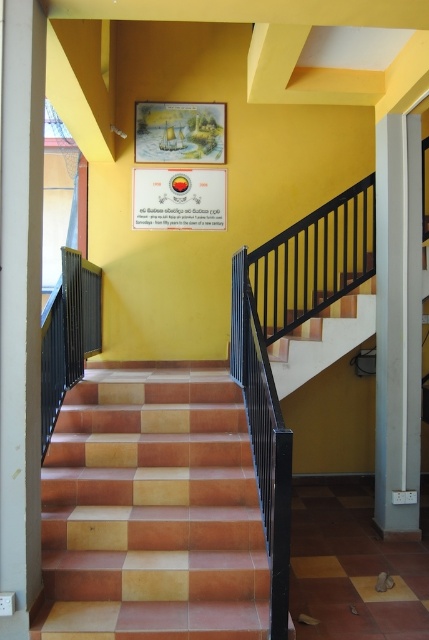
Question: Does white smooth pillar at left appear on the right side of matte paper sign at upper center?

Choices:
 (A) no
 (B) yes

Answer: (A)

Question: Which object is positioned closest to the white smooth pillar at left?

Choices:
 (A) white smooth pillar at right
 (B) terracotta tile stairs at center

Answer: (B)

Question: Which object is positioned farthest from the white smooth pillar at left?

Choices:
 (A) white smooth pillar at right
 (B) terracotta tile stairs at center
 (C) matte paper sign at upper center

Answer: (C)

Question: Does terracotta tile stairs at center come in front of matte paper sign at upper center?

Choices:
 (A) no
 (B) yes

Answer: (B)

Question: Among these objects, which one is farthest from the camera?

Choices:
 (A) matte paper sign at upper center
 (B) white smooth pillar at left
 (C) terracotta tile stairs at center
 (D) white smooth pillar at right

Answer: (A)

Question: Can you confirm if terracotta tile stairs at center is smaller than matte paper sign at upper center?

Choices:
 (A) yes
 (B) no

Answer: (B)